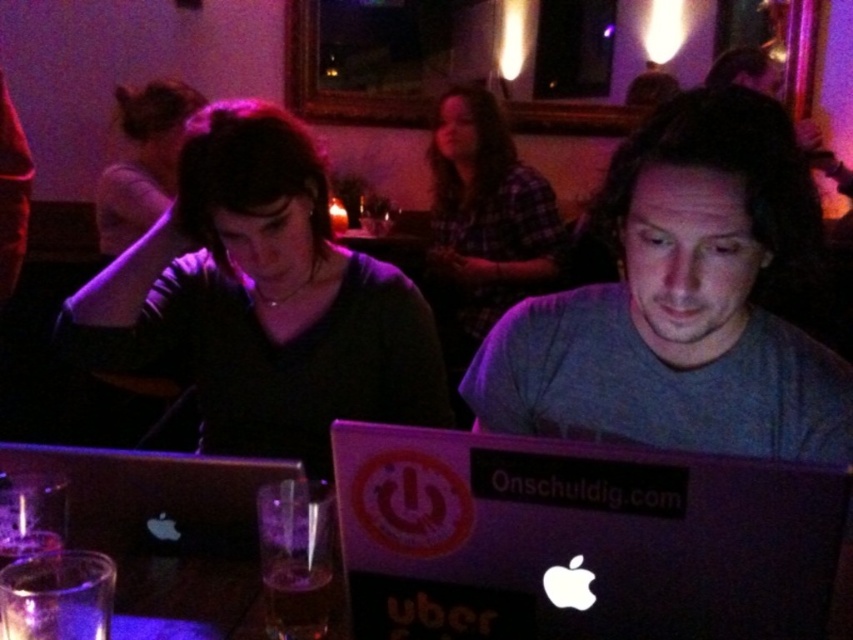
You are organizing a tech event and need to decide which laptop to use for a presentation. The black matte laptop at center is available, but you also have a plaid fabric shirt at center. Which item is more suitable for the presentation based on their sizes?

The black matte laptop at center has a smaller size compared to the plaid fabric shirt at center, so the plaid fabric shirt at center is more suitable for the presentation as it is larger and likely provides a better display area.

You are standing in front of the two people at the table. You notice two points marked on the image. Which point, point 1 at coordinates (532, 236) or point 2 at (167, 141), is closer to you?

Point 1 at coordinates (532, 236) is closer to the viewer than point 2 at (167, 141).

You are a photographer taking a picture of the scene. You notice the gray matte shirt at center and the matte black shirt at upper center. Which shirt will appear larger in your photo?

The gray matte shirt at center will appear larger in the photo because it is closer to the viewer than the matte black shirt at upper center.